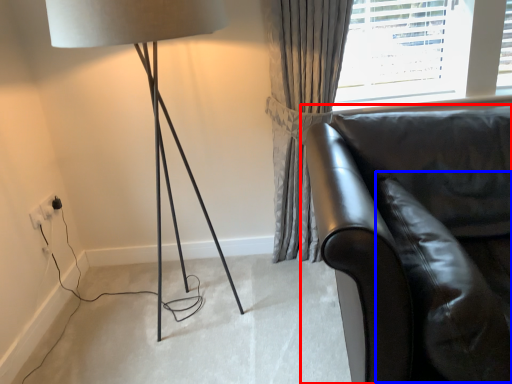
Question: Which point is further to the camera, studio couch (highlighted by a red box) or swivel chair (highlighted by a blue box)?

Choices:
 (A) studio couch
 (B) swivel chair

Answer: (B)